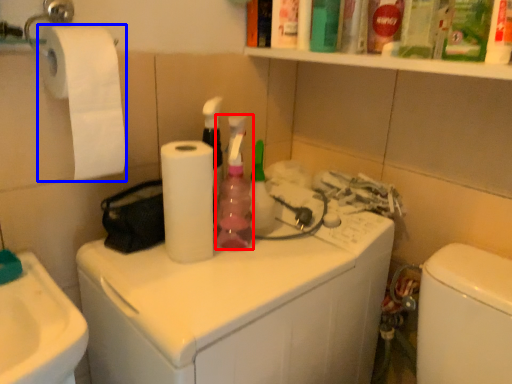
Question: Among these objects, which one is farthest to the camera, cleaning product (highlighted by a red box) or toilet paper (highlighted by a blue box)?

Choices:
 (A) cleaning product
 (B) toilet paper

Answer: (A)